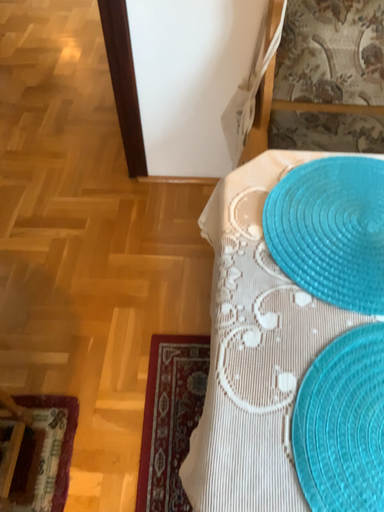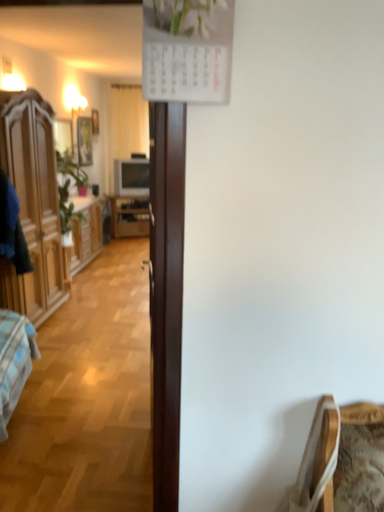
Question: Which way did the camera rotate in the video?

Choices:
 (A) rotated downward
 (B) rotated upward

Answer: (B)